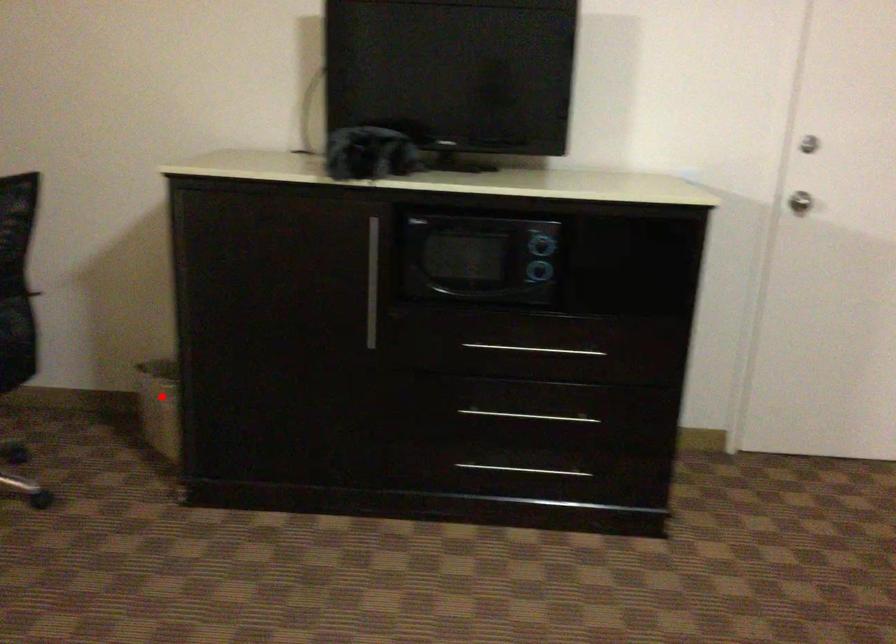
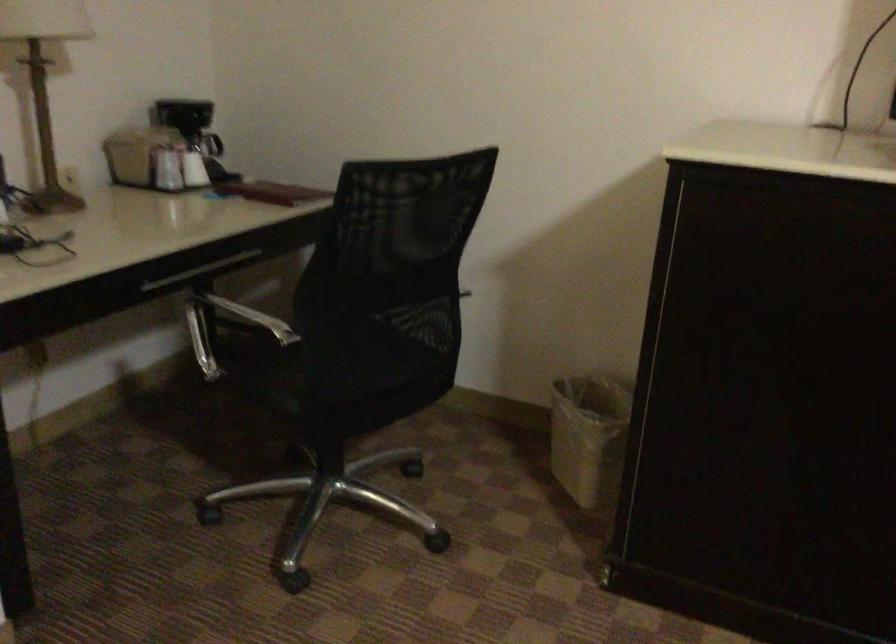
Question: I am providing you with two images of the same scene from different viewpoints. A red point is shown in image1. For the corresponding object point in image2, is it positioned nearer or farther from the camera?

Choices:
 (A) Nearer
 (B) Farther

Answer: (A)